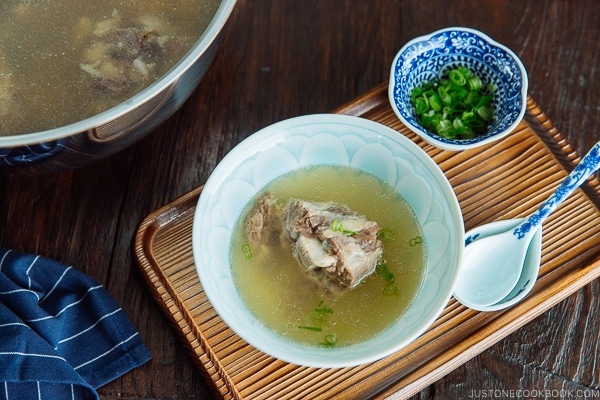
Locate an element on the screen. spoon is located at coordinates (490, 261).